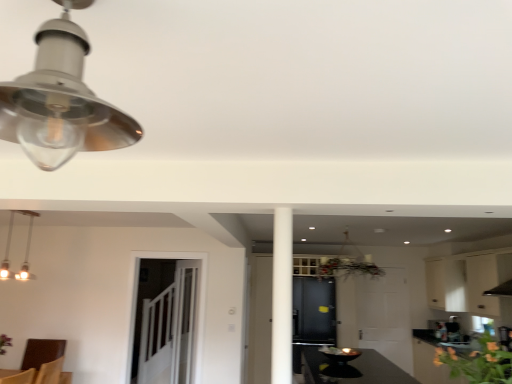
Locate an element on the screen. The width and height of the screenshot is (512, 384). matte black cabinet at center, the second cabinetry positioned from the right is located at coordinates (314, 310).

What is the approximate width of white matte cabinet at upper right, the first cabinetry when ordered from right to left?

white matte cabinet at upper right, the first cabinetry when ordered from right to left, is 16.20 inches wide.

How much space does white glossy pendant light at upper left, the 1th lamp when ordered from back to front, occupy horizontally?

white glossy pendant light at upper left, the 1th lamp when ordered from back to front, is 7.88 inches wide.

What do you see at coordinates (61, 100) in the screenshot? I see `matte silver lampshade at upper left, placed as the second lamp when sorted from back to front` at bounding box center [61, 100].

At what (x,y) coordinates should I click in order to perform the action: click on matte silver lampshade at upper left, which ranks as the 2th lamp in bottom-to-top order. Please return your answer as a coordinate pair (x, y). The image size is (512, 384). Looking at the image, I should click on (61, 100).

This screenshot has height=384, width=512. I want to click on matte black cabinet at center, the second cabinetry positioned from the right, so click(314, 310).

Is matte black cabinet at center, which is counted as the 1th cabinetry, starting from the left, beside clear glass door at center?

No, matte black cabinet at center, which is counted as the 1th cabinetry, starting from the left, is not next to clear glass door at center.

Who is bigger, matte black cabinet at center, which is counted as the 1th cabinetry, starting from the left, or clear glass door at center?

matte black cabinet at center, which is counted as the 1th cabinetry, starting from the left, is bigger.

From the image's perspective, would you say matte black cabinet at center, the second cabinetry positioned from the right, is positioned over clear glass door at center?

No, from the image's perspective, matte black cabinet at center, the second cabinetry positioned from the right, is not above clear glass door at center.

Considering the points (508, 278) and (498, 349), which point is behind, point (508, 278) or point (498, 349)?

The point (508, 278) is more distant.

Measure the distance from white matte cabinet at upper right, which appears as the second cabinetry when viewed from the left, to green leafy plant at lower right.

11.24 feet.

Considering the sizes of objects white matte cabinet at upper right, the first cabinetry when ordered from right to left, and green leafy plant at lower right in the image provided, who is smaller, white matte cabinet at upper right, the first cabinetry when ordered from right to left, or green leafy plant at lower right?

green leafy plant at lower right.

Is white matte cabinet at upper right, which appears as the second cabinetry when viewed from the left, to the left of green leafy plant at lower right from the viewer's perspective?

No.

From a real-world perspective, does matte silver lampshade at upper left, the 1th lamp from the top, sit lower than matte black cabinet at center, the second cabinetry positioned from the right?

No, from a real-world perspective, matte silver lampshade at upper left, the 1th lamp from the top, is not under matte black cabinet at center, the second cabinetry positioned from the right.

Considering the relative positions of matte silver lampshade at upper left, which ranks as the 2th lamp in bottom-to-top order, and matte black cabinet at center, which is counted as the 1th cabinetry, starting from the left, in the image provided, is matte silver lampshade at upper left, which ranks as the 2th lamp in bottom-to-top order, to the left or to the right of matte black cabinet at center, which is counted as the 1th cabinetry, starting from the left,?

From the image, it's evident that matte silver lampshade at upper left, which ranks as the 2th lamp in bottom-to-top order, is to the left of matte black cabinet at center, which is counted as the 1th cabinetry, starting from the left.

Is matte silver lampshade at upper left, acting as the 1th lamp starting from the front, positioned far away from matte black cabinet at center, which is counted as the 1th cabinetry, starting from the left?

That's right, there is a large distance between matte silver lampshade at upper left, acting as the 1th lamp starting from the front, and matte black cabinet at center, which is counted as the 1th cabinetry, starting from the left.

In order to click on the 2nd cabinetry below when counting from the matte silver lampshade at upper left, the 2th lamp positioned from the left (from the image's perspective) in this screenshot , I will do `click(314, 310)`.

Is matte black cabinet at center, which is counted as the 1th cabinetry, starting from the left, oriented towards matte silver lampshade at upper left, the 1th lamp from the top?

Yes.

Considering the sizes of matte black cabinet at center, the second cabinetry positioned from the right, and matte silver lampshade at upper left, acting as the 1th lamp starting from the front, in the image, is matte black cabinet at center, the second cabinetry positioned from the right, taller or shorter than matte silver lampshade at upper left, acting as the 1th lamp starting from the front,?

In the image, matte black cabinet at center, the second cabinetry positioned from the right, appears to be taller than matte silver lampshade at upper left, acting as the 1th lamp starting from the front.

Which lamp is the 2nd one when counting from the front of the matte black cabinet at center, the second cabinetry positioned from the right? Please provide its 2D coordinates.

[(61, 100)]

Is point (306, 329) behind point (78, 122)?

Yes, it is behind point (78, 122).

Which point is more forward, (192, 302) or (485, 252)?

Positioned in front is point (192, 302).

Is clear glass door at center outside of white matte cabinet at upper right, the first cabinetry when ordered from right to left?

Yes, clear glass door at center is outside of white matte cabinet at upper right, the first cabinetry when ordered from right to left.

Considering the positions of objects clear glass door at center and white matte cabinet at upper right, the first cabinetry when ordered from right to left, in the image provided, who is more to the right, clear glass door at center or white matte cabinet at upper right, the first cabinetry when ordered from right to left,?

white matte cabinet at upper right, the first cabinetry when ordered from right to left.

Is clear glass door at center in front of or behind white matte cabinet at upper right, the first cabinetry when ordered from right to left, in the image?

Visually, clear glass door at center is located behind white matte cabinet at upper right, the first cabinetry when ordered from right to left.

Is white glossy pendant light at upper left, marked as the second lamp in a front-to-back arrangement, taller or shorter than matte silver lampshade at upper left, which is the 1th lamp from right to left?

In the image, white glossy pendant light at upper left, marked as the second lamp in a front-to-back arrangement, appears to be taller than matte silver lampshade at upper left, which is the 1th lamp from right to left.

Considering the relative sizes of white glossy pendant light at upper left, placed as the second lamp when sorted from top to bottom, and matte silver lampshade at upper left, acting as the 1th lamp starting from the front, in the image provided, is white glossy pendant light at upper left, placed as the second lamp when sorted from top to bottom, bigger than matte silver lampshade at upper left, acting as the 1th lamp starting from the front,?

Correct, white glossy pendant light at upper left, placed as the second lamp when sorted from top to bottom, is larger in size than matte silver lampshade at upper left, acting as the 1th lamp starting from the front.

Is white glossy pendant light at upper left, placed as the second lamp when sorted from top to bottom, placed right next to matte silver lampshade at upper left, the 2th lamp positioned from the left?

No, white glossy pendant light at upper left, placed as the second lamp when sorted from top to bottom, is not touching matte silver lampshade at upper left, the 2th lamp positioned from the left.

Measure the distance from white glossy pendant light at upper left, the 1th lamp when ordered from back to front, to matte silver lampshade at upper left, which ranks as the 2th lamp in bottom-to-top order.

white glossy pendant light at upper left, the 1th lamp when ordered from back to front, and matte silver lampshade at upper left, which ranks as the 2th lamp in bottom-to-top order, are 3.85 meters apart from each other.

Could matte black cabinet at center, the second cabinetry positioned from the right, be considered to be inside white matte cabinet at upper right, which appears as the second cabinetry when viewed from the left?

No, matte black cabinet at center, the second cabinetry positioned from the right, is not surrounded by white matte cabinet at upper right, which appears as the second cabinetry when viewed from the left.

Is white matte cabinet at upper right, which appears as the second cabinetry when viewed from the left, positioned far away from matte black cabinet at center, the second cabinetry positioned from the right?

white matte cabinet at upper right, which appears as the second cabinetry when viewed from the left, is far away from matte black cabinet at center, the second cabinetry positioned from the right.

Which is behind, white matte cabinet at upper right, which appears as the second cabinetry when viewed from the left, or matte black cabinet at center, which is counted as the 1th cabinetry, starting from the left?

matte black cabinet at center, which is counted as the 1th cabinetry, starting from the left, is further from the camera.

Identify the location of glass door in front of the matte black cabinet at center, the second cabinetry positioned from the right. The image size is (512, 384). (184, 322).

At what (x,y) coordinates should I click in order to perform the action: click on cabinetry that appears above the green leafy plant at lower right (from a real-world perspective). Please return your answer as a coordinate pair (x, y). The image size is (512, 384). Looking at the image, I should click on (468, 281).

Consider the image. Which object lies further to the anchor point matte silver lampshade at upper left, placed as the second lamp when sorted from back to front, white matte cabinet at upper right, which appears as the second cabinetry when viewed from the left, or matte black cabinet at center, which is counted as the 1th cabinetry, starting from the left?

Among the two, white matte cabinet at upper right, which appears as the second cabinetry when viewed from the left, is located further to matte silver lampshade at upper left, placed as the second lamp when sorted from back to front.

Which object lies further to the anchor point green leafy plant at lower right, white glossy pendant light at upper left, which is the first lamp in left-to-right order, or white matte cabinet at upper right, the first cabinetry when ordered from right to left?

white glossy pendant light at upper left, which is the first lamp in left-to-right order, is further to green leafy plant at lower right.

Which object lies further to the anchor point white matte cabinet at upper right, which appears as the second cabinetry when viewed from the left, matte black cabinet at center, the second cabinetry positioned from the right, or white glossy pendant light at upper left, placed as the second lamp when sorted from top to bottom?

white glossy pendant light at upper left, placed as the second lamp when sorted from top to bottom.

Considering their positions, is matte silver lampshade at upper left, acting as the 1th lamp starting from the front, positioned closer to green leafy plant at lower right than clear glass door at center?

matte silver lampshade at upper left, acting as the 1th lamp starting from the front.

Which object lies further to the anchor point white matte cabinet at upper right, the first cabinetry when ordered from right to left, matte silver lampshade at upper left, which is the 1th lamp from right to left, or white glossy pendant light at upper left, the 1th lamp when ordered from back to front?

Based on the image, matte silver lampshade at upper left, which is the 1th lamp from right to left, appears to be further to white matte cabinet at upper right, the first cabinetry when ordered from right to left.

Estimate the real-world distances between objects in this image. Which object is closer to white glossy pendant light at upper left, the 2th lamp when ordered from right to left, matte silver lampshade at upper left, acting as the 1th lamp starting from the front, or green leafy plant at lower right?

Based on the image, matte silver lampshade at upper left, acting as the 1th lamp starting from the front, appears to be nearer to white glossy pendant light at upper left, the 2th lamp when ordered from right to left.

Based on their spatial positions, is green leafy plant at lower right or white glossy pendant light at upper left, which is the 1th lamp from bottom to top, closer to white matte cabinet at upper right, which appears as the second cabinetry when viewed from the left?

green leafy plant at lower right.

Looking at the image, which one is located closer to white glossy pendant light at upper left, placed as the second lamp when sorted from top to bottom, white matte cabinet at upper right, the first cabinetry when ordered from right to left, or matte black cabinet at center, the second cabinetry positioned from the right?

Among the two, matte black cabinet at center, the second cabinetry positioned from the right, is located nearer to white glossy pendant light at upper left, placed as the second lamp when sorted from top to bottom.

The width and height of the screenshot is (512, 384). Find the location of `flower between matte silver lampshade at upper left, which ranks as the 2th lamp in bottom-to-top order, and matte black cabinet at center, the second cabinetry positioned from the right, in the front-back direction`. flower between matte silver lampshade at upper left, which ranks as the 2th lamp in bottom-to-top order, and matte black cabinet at center, the second cabinetry positioned from the right, in the front-back direction is located at coordinates (478, 363).

Where is `lamp between green leafy plant at lower right and clear glass door at center in the front-back direction`? This screenshot has width=512, height=384. lamp between green leafy plant at lower right and clear glass door at center in the front-back direction is located at coordinates (25, 252).

Locate an element on the screen. The image size is (512, 384). lamp located between matte silver lampshade at upper left, the 2th lamp positioned from the left, and clear glass door at center in the depth direction is located at coordinates (25, 252).

Where is `cabinetry situated between white glossy pendant light at upper left, the 2th lamp when ordered from right to left, and white matte cabinet at upper right, the first cabinetry when ordered from right to left, from left to right`? cabinetry situated between white glossy pendant light at upper left, the 2th lamp when ordered from right to left, and white matte cabinet at upper right, the first cabinetry when ordered from right to left, from left to right is located at coordinates (314, 310).